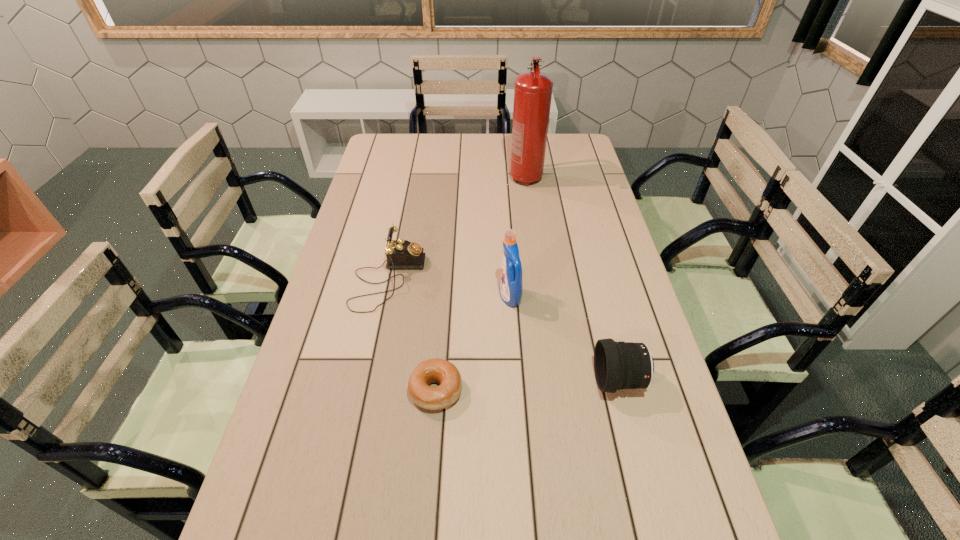
Image resolution: width=960 pixels, height=540 pixels. I want to click on free space at the right edge of the desktop, so click(x=611, y=256).

In order to click on blank region between the leftmost object and the tallest object in this screenshot , I will do `click(457, 229)`.

Identify the location of vacant area that lies between the farthest object and the bagel. (481, 285).

The width and height of the screenshot is (960, 540). I want to click on vacant area between the tallest object and the rightmost object, so click(x=572, y=279).

Locate an element on the screen. free spot between the fire extinguisher and the bagel is located at coordinates click(x=481, y=285).

You are a GUI agent. You are given a task and a screenshot of the screen. Output one action in this format:
    pyautogui.click(x=<x>, y=<y>)
    Task: Click on the free space that is in between the detergent and the telephone
    The width and height of the screenshot is (960, 540).
    Given the screenshot: What is the action you would take?
    pyautogui.click(x=449, y=288)

Locate an element on the screen. This screenshot has width=960, height=540. vacant space in between the second object from left to right and the rightmost object is located at coordinates (527, 386).

Image resolution: width=960 pixels, height=540 pixels. I want to click on vacant region between the fire extinguisher and the leftmost object, so click(457, 229).

The height and width of the screenshot is (540, 960). What are the coordinates of `free space between the second tallest object and the leftmost object` in the screenshot? It's located at (449, 288).

Image resolution: width=960 pixels, height=540 pixels. What are the coordinates of `vacant area that lies between the fourth shortest object and the second object from left to right` in the screenshot? It's located at (473, 344).